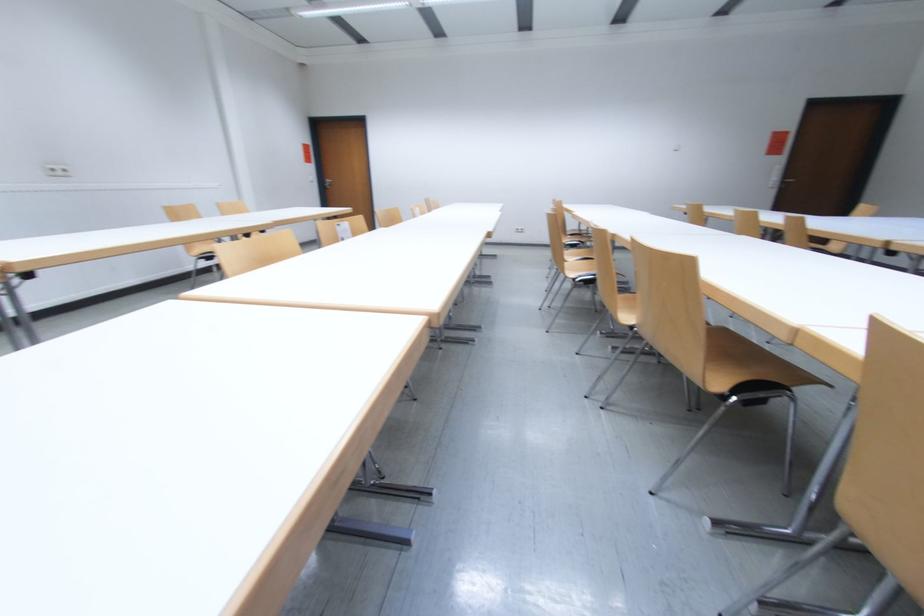
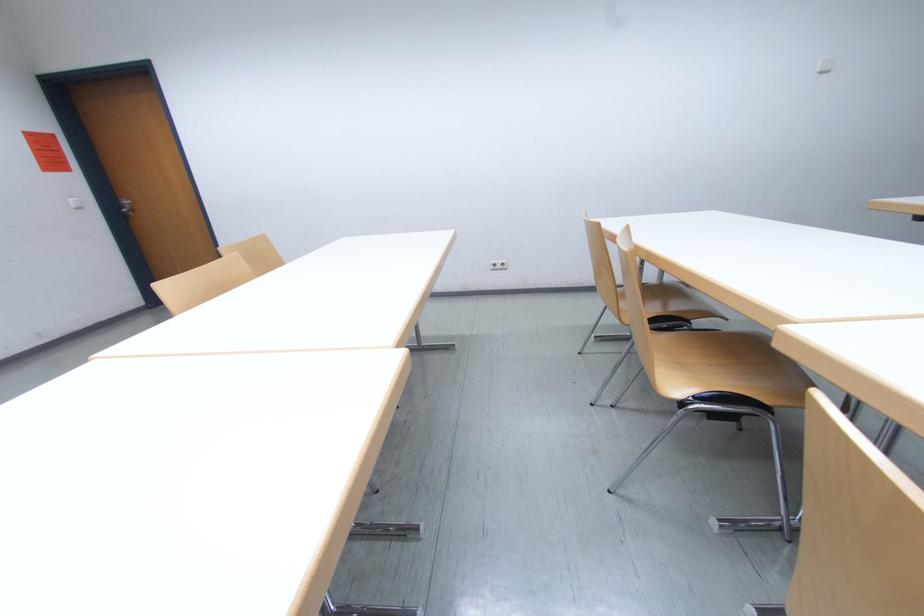
In the second image, find the point that corresponds to the point at 528,231 in the first image.

(505, 265)